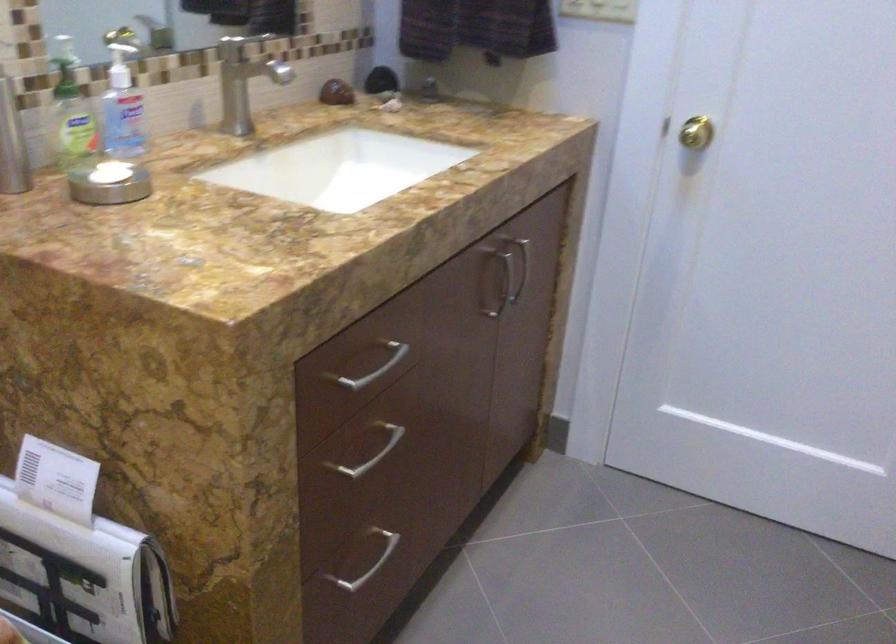
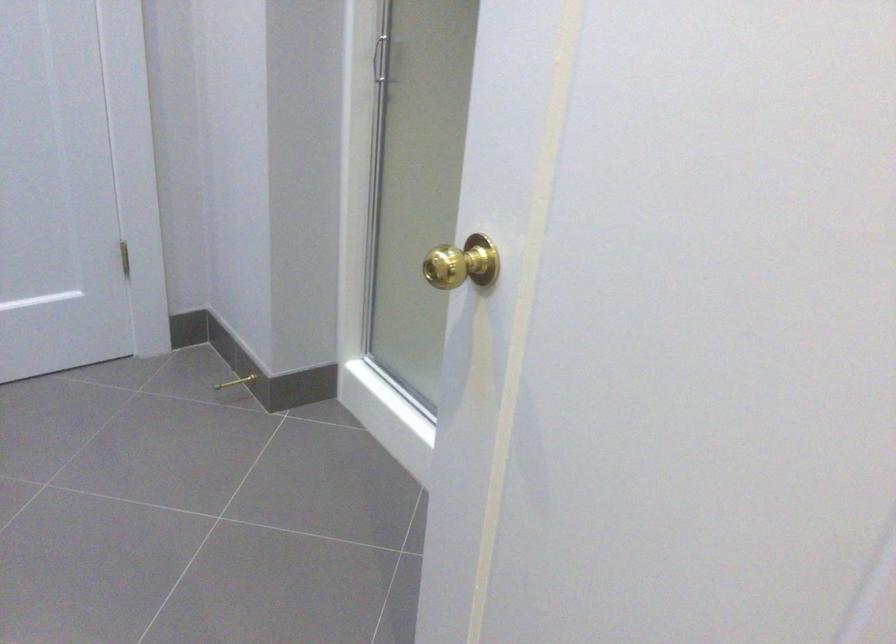
First-person continuous shooting, in which direction is the camera rotating?

The camera rotated toward right-down.